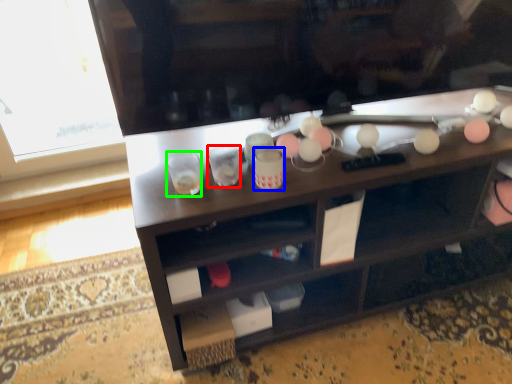
Question: Which object is the farthest from shot glass (highlighted by a red box)? Choose among these: beverage (highlighted by a blue box) or shot glass (highlighted by a green box).

Choices:
 (A) beverage
 (B) shot glass

Answer: (A)